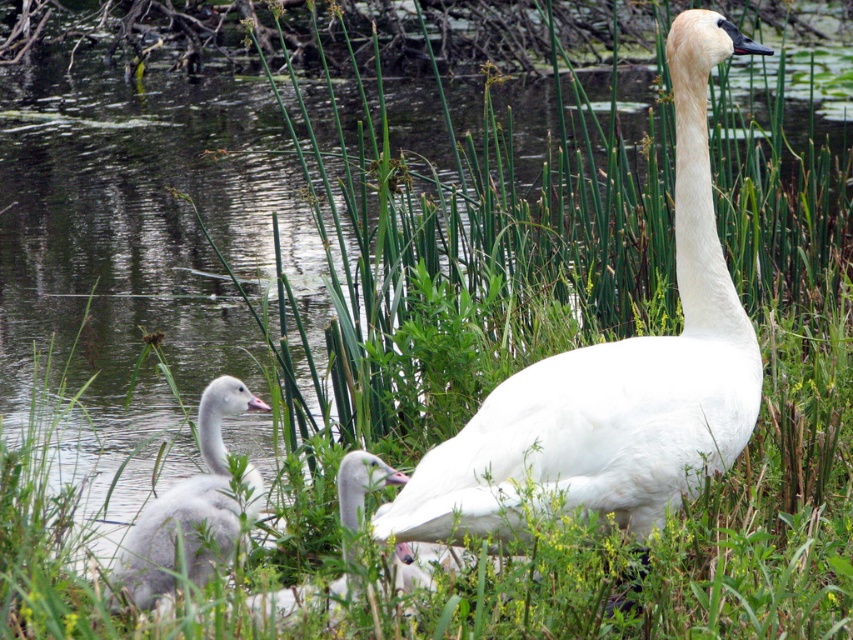
Does white feathered swan at center have a greater height compared to white matte duckling at center?

Indeed, white feathered swan at center has a greater height compared to white matte duckling at center.

Is white feathered swan at center positioned in front of white matte duckling at center?

That is False.

Who is more forward, (691, 168) or (379, 460)?

Point (379, 460) is in front.

Find the location of a particular element. The width and height of the screenshot is (853, 640). white feathered swan at center is located at coordinates (614, 376).

Who is taller, gray downy swan at lower left or white matte duckling at center?

With more height is gray downy swan at lower left.

Image resolution: width=853 pixels, height=640 pixels. Find the location of `gray downy swan at lower left`. gray downy swan at lower left is located at coordinates (189, 509).

The width and height of the screenshot is (853, 640). I want to click on gray downy swan at lower left, so click(189, 509).

Consider the image. Is white feathered swan at center further to the viewer compared to gray downy swan at lower left?

That is False.

Who is more distant from viewer, (680,157) or (183,552)?

Point (680,157)

Locate an element on the screen. white feathered swan at center is located at coordinates (614, 376).